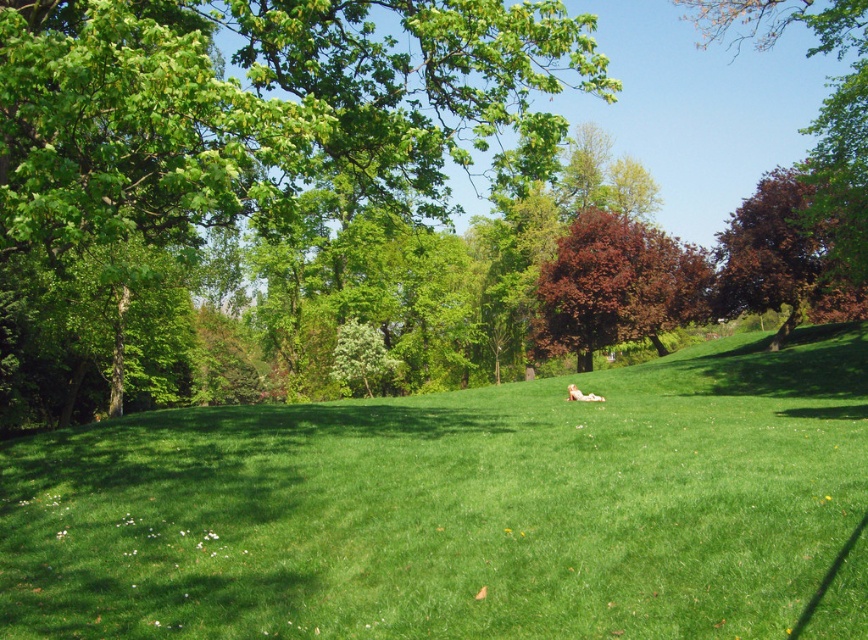
Between dark red leafy tree at center and white fluffy dog at center, which one appears on the left side from the viewer's perspective?

From the viewer's perspective, white fluffy dog at center appears more on the left side.

This screenshot has height=640, width=868. What do you see at coordinates (616, 285) in the screenshot?
I see `dark red leafy tree at center` at bounding box center [616, 285].

Between point (695, 282) and point (573, 394), which one is positioned in front?

Point (573, 394) is in front.

Locate an element on the screen. dark red leafy tree at center is located at coordinates (616, 285).

Is brown leafy tree at upper right wider than white fluffy dog at center?

Yes, brown leafy tree at upper right is wider than white fluffy dog at center.

Is brown leafy tree at upper right to the left of white fluffy dog at center from the viewer's perspective?

Incorrect, brown leafy tree at upper right is not on the left side of white fluffy dog at center.

At what (x,y) coordinates should I click in order to perform the action: click on brown leafy tree at upper right. Please return your answer as a coordinate pair (x, y). Looking at the image, I should click on (819, 109).

Does green grassy field at center have a smaller size compared to dark brown textured tree at upper right?

Correct, green grassy field at center occupies less space than dark brown textured tree at upper right.

Does green grassy field at center appear on the right side of dark brown textured tree at upper right?

Incorrect, green grassy field at center is not on the right side of dark brown textured tree at upper right.

Locate an element on the screen. This screenshot has width=868, height=640. green grassy field at center is located at coordinates pos(454,506).

Where is `green grassy field at center`? green grassy field at center is located at coordinates (454, 506).